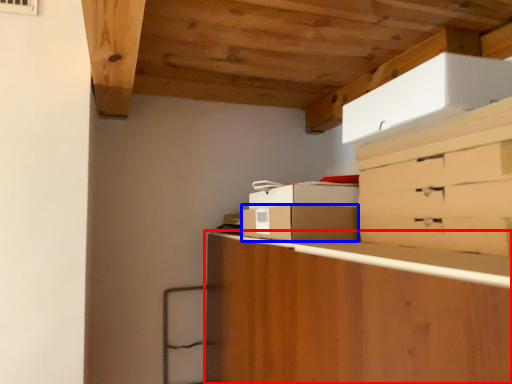
Question: Among these objects, which one is nearest to the camera, cabinetry (highlighted by a red box) or cardboard box (highlighted by a blue box)?

Choices:
 (A) cabinetry
 (B) cardboard box

Answer: (A)